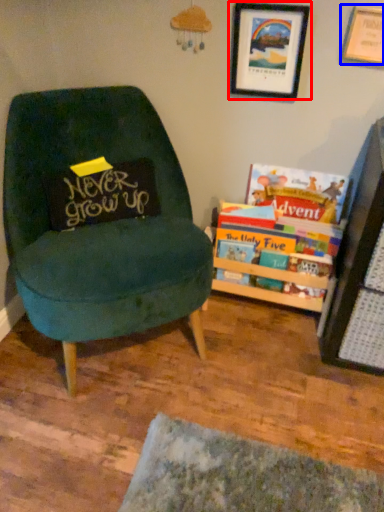
Question: Which object is closer to the camera taking this photo, picture frame (highlighted by a red box) or picture frame (highlighted by a blue box)?

Choices:
 (A) picture frame
 (B) picture frame

Answer: (B)